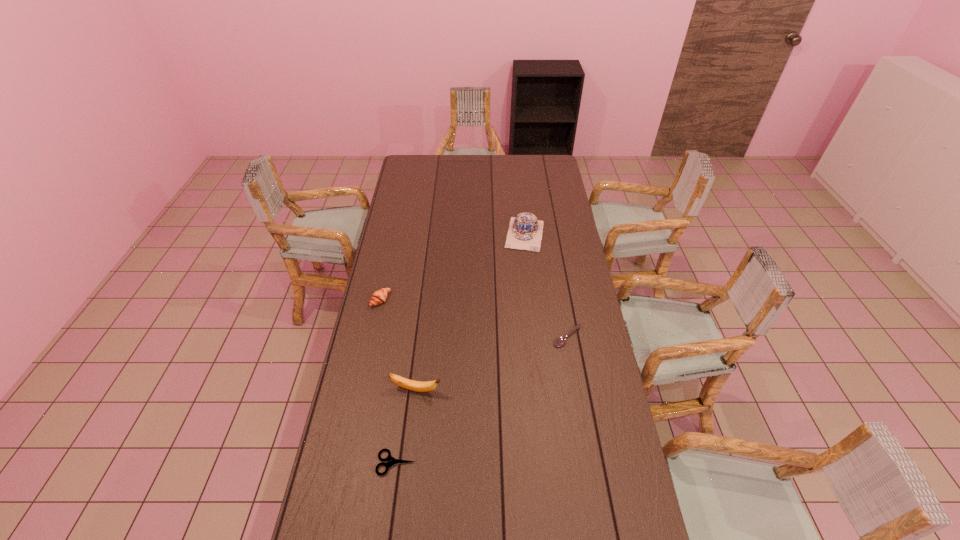
Find the location of `object that stands as the fourth closest to the farthest object`. object that stands as the fourth closest to the farthest object is located at coordinates (391, 460).

Choose which object is the second nearest neighbor to the shears. Please provide its 2D coordinates. Your answer should be formatted as a tuple, i.e. [(x, y)], where the tuple contains the x and y coordinates of a point satisfying the conditions above.

[(380, 296)]

Locate an element on the screen. free space that satisfies the following two spatial constraints: 1. on the front side of the second nearest object; 2. on the right side of the second farthest object is located at coordinates (361, 390).